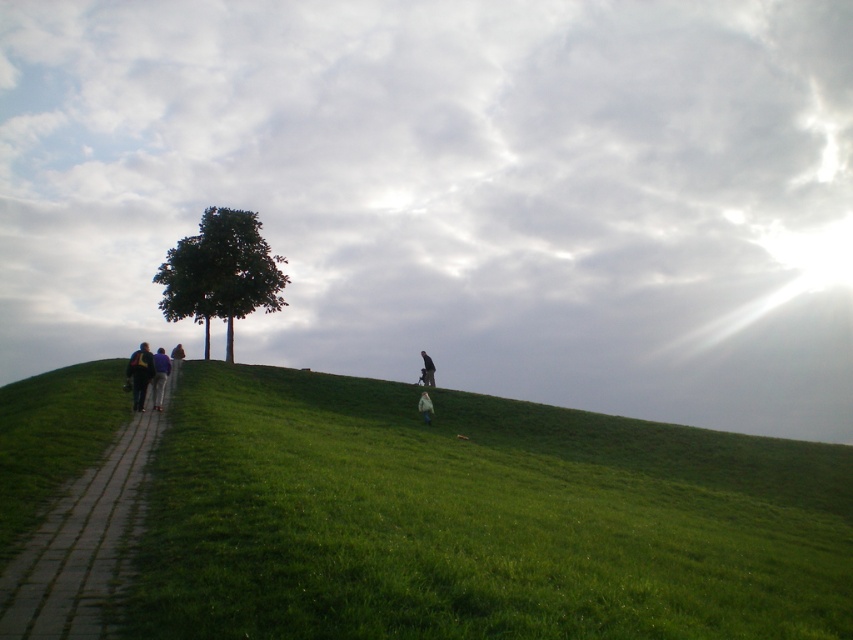
Question: Is paved stone path at lower left above green leafy tree at center?

Choices:
 (A) no
 (B) yes

Answer: (A)

Question: Which object is farther from the camera taking this photo?

Choices:
 (A) green grass at lower left
 (B) white fleece jacket at center
 (C) green leafy tree at center
 (D) paved stone path at lower left

Answer: (C)

Question: Is green grass at lower left below dark blue jeans at left?

Choices:
 (A) yes
 (B) no

Answer: (A)

Question: Which point is farther from the camera taking this photo?

Choices:
 (A) (461, 465)
 (B) (425, 396)
 (C) (157, 378)

Answer: (B)

Question: Which point is closer to the camera?

Choices:
 (A) white fleece jacket at center
 (B) blue fabric jacket at lower left

Answer: (B)

Question: Is green grass at lower left positioned before blue fabric jacket at lower left?

Choices:
 (A) yes
 (B) no

Answer: (A)